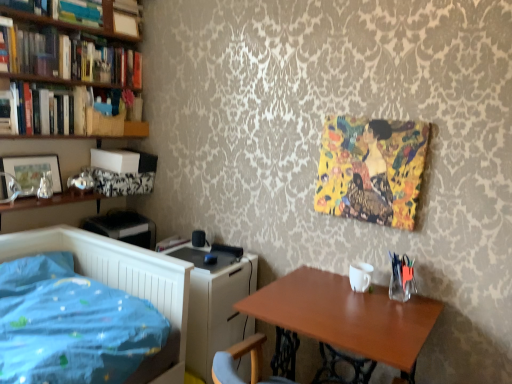
Question: From the image's perspective, is yellow fabric painting at upper right above hardcover books at left, the second book when ordered from bottom to top?

Choices:
 (A) no
 (B) yes

Answer: (A)

Question: Considering the relative sizes of yellow fabric painting at upper right and hardcover books at left, the fifth book from the top, in the image provided, is yellow fabric painting at upper right bigger than hardcover books at left, the fifth book from the top,?

Choices:
 (A) no
 (B) yes

Answer: (A)

Question: Does yellow fabric painting at upper right lie behind hardcover books at left, the second book when ordered from bottom to top?

Choices:
 (A) no
 (B) yes

Answer: (A)

Question: Is hardcover books at left, the second book when ordered from bottom to top, surrounded by yellow fabric painting at upper right?

Choices:
 (A) yes
 (B) no

Answer: (B)

Question: Is yellow fabric painting at upper right next to hardcover books at left, the second book when ordered from bottom to top, and touching it?

Choices:
 (A) yes
 (B) no

Answer: (B)

Question: Is hardcover books at upper left, the 4th book positioned from the top, taller or shorter than hardcover books at left, the fifth book from the top?

Choices:
 (A) short
 (B) tall

Answer: (A)

Question: From a real-world perspective, is hardcover books at upper left, acting as the third book starting from the bottom, positioned above or below hardcover books at left, the second book when ordered from bottom to top?

Choices:
 (A) below
 (B) above

Answer: (B)

Question: From the image's perspective, relative to hardcover books at left, the second book when ordered from bottom to top, is hardcover books at upper left, the 4th book positioned from the top, above or below?

Choices:
 (A) above
 (B) below

Answer: (A)

Question: Considering the positions of hardcover books at upper left, acting as the third book starting from the bottom, and hardcover books at left, the second book when ordered from bottom to top, in the image, is hardcover books at upper left, acting as the third book starting from the bottom, wider or thinner than hardcover books at left, the second book when ordered from bottom to top,?

Choices:
 (A) wide
 (B) thin

Answer: (B)

Question: In terms of size, does wooden table at lower right appear bigger or smaller than yellow fabric painting at upper right?

Choices:
 (A) big
 (B) small

Answer: (A)

Question: From a real-world perspective, is wooden table at lower right above or below yellow fabric painting at upper right?

Choices:
 (A) above
 (B) below

Answer: (B)

Question: Does point (313, 332) appear closer or farther from the camera than point (415, 125)?

Choices:
 (A) closer
 (B) farther

Answer: (A)

Question: Based on their positions, is wooden table at lower right located to the left or right of yellow fabric painting at upper right?

Choices:
 (A) right
 (B) left

Answer: (B)

Question: Considering the positions of hardcover books at upper left, which is counted as the third book, starting from the top, and hardcover books at upper left, acting as the third book starting from the bottom, in the image, is hardcover books at upper left, which is counted as the third book, starting from the top, bigger or smaller than hardcover books at upper left, acting as the third book starting from the bottom,?

Choices:
 (A) small
 (B) big

Answer: (B)

Question: From the image's perspective, is hardcover books at upper left, which is counted as the third book, starting from the top, located above or below hardcover books at upper left, the 4th book positioned from the top?

Choices:
 (A) above
 (B) below

Answer: (A)